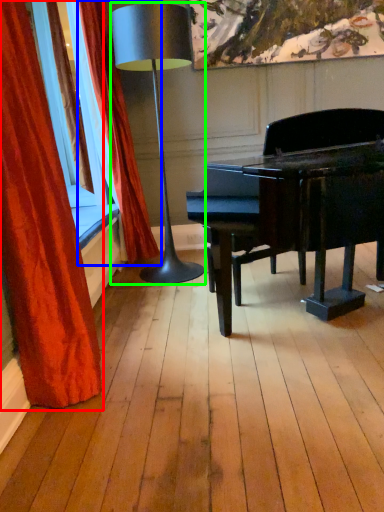
Question: Which object is the closest to the curtain (highlighted by a red box)? Choose among these: curtain (highlighted by a blue box) or lamp (highlighted by a green box).

Choices:
 (A) curtain
 (B) lamp

Answer: (B)